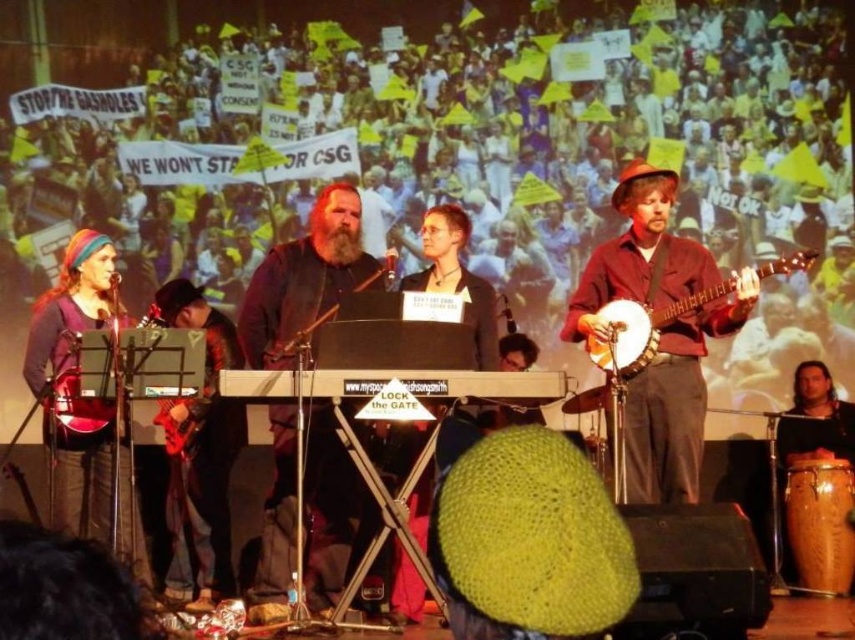
You are a photographer at the live performance and want to capture both the wooden banjo at right and the black keyboard at center in a single shot. Based on their positions, which instrument should you position on the right side of your camera frame?

The wooden banjo at right is to the right of the black keyboard at center, so you should position the wooden banjo at right on the right side of your camera frame.

You are a photographer standing at the back of the stage. You want to take a photo that includes both the wooden banjo at right and the black keyboard at center. What is the minimum distance you need to move forward to ensure both instruments are in frame?

The wooden banjo at right is 2.32 meters away from the black keyboard at center. To include both in the photo, you need to move forward until you can capture both instruments within your camera frame. The exact distance depends on your camera lens, but the instruments are separated by 2.32 meters.